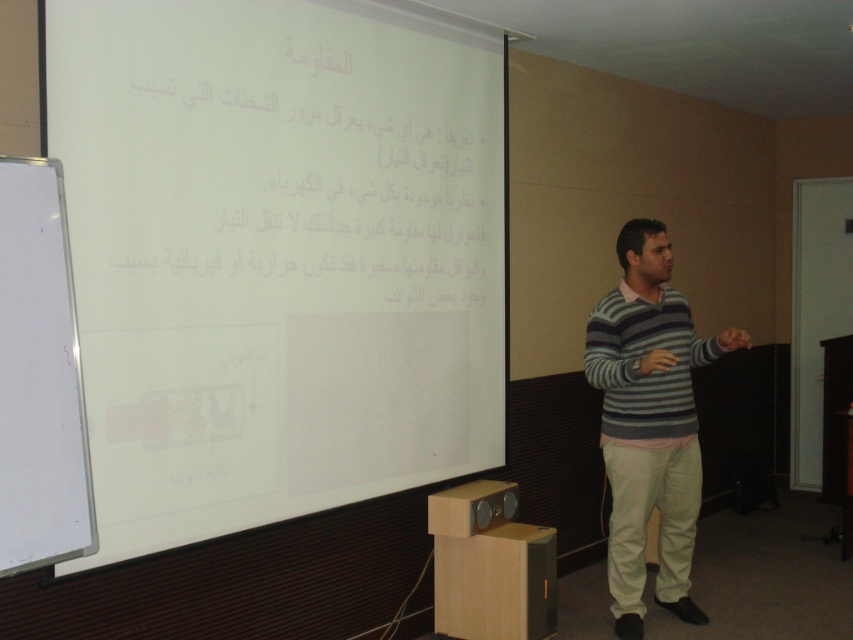
Question: Which point is closer to the camera?

Choices:
 (A) (39, 394)
 (B) (624, 493)

Answer: (A)

Question: In this image, where is striped sweater at center located relative to whiteboard at left?

Choices:
 (A) right
 (B) left

Answer: (A)

Question: Can you confirm if striped sweater at center is smaller than whiteboard at left?

Choices:
 (A) no
 (B) yes

Answer: (A)

Question: Which point is closer to the camera taking this photo?

Choices:
 (A) (596, 336)
 (B) (30, 294)

Answer: (B)

Question: In this image, where is striped sweater at center located relative to whiteboard at left?

Choices:
 (A) above
 (B) below

Answer: (B)